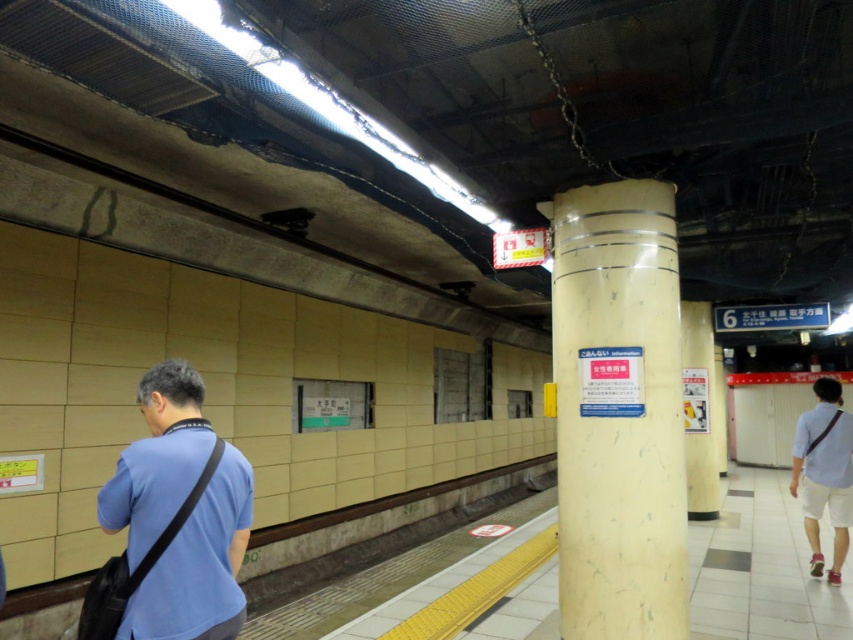
Based on the photo, you are a photographer trying to capture a candid shot of the blue fabric bag at left and the white cotton shorts at right. Since you want to ensure both are in focus, you need to know which object is wider. Which one is wider?

The white cotton shorts at right are wider than the blue fabric bag at left.

You are standing on the subway platform and want to place your blue fabric bag at left on the yellow matte pillar at center for a moment. Is the pillar to the right or left of your bag?

The yellow matte pillar at center is to the right of the blue fabric bag at left, so the pillar is to the right of your bag.

You are standing at point (834, 477) and want to move to the yellow tactile paving strip. Which direction should you walk to reach the yellow tactile paving strip without passing through point (653, 355)?

Since point (653, 355) is in front of point (834, 477), you should walk in the opposite direction of point (653, 355) to reach the yellow tactile paving strip without passing through it.